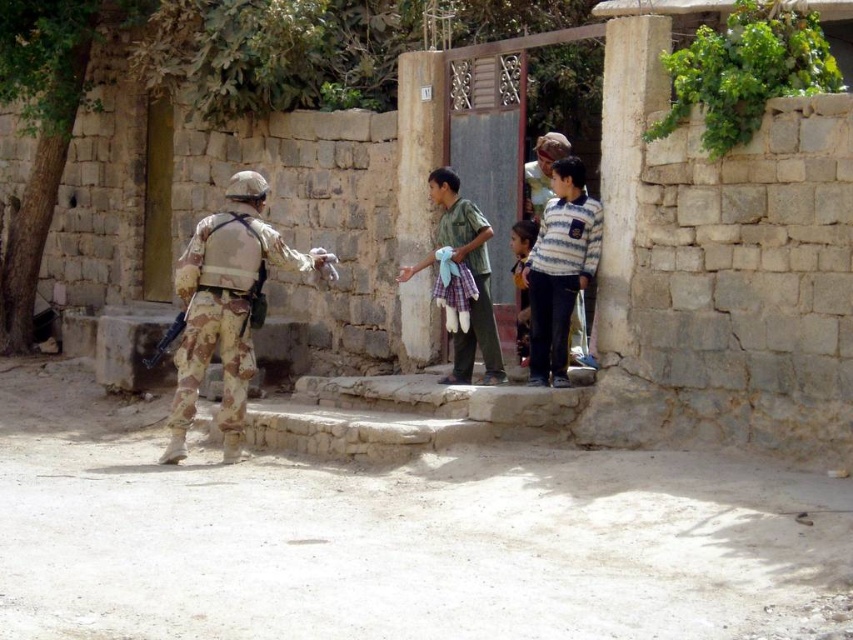
Can you confirm if camouflage uniform at left is taller than striped cotton shirt at center?

Yes.

Which is above, camouflage uniform at left or striped cotton shirt at center?

Positioned higher is striped cotton shirt at center.

Image resolution: width=853 pixels, height=640 pixels. I want to click on camouflage uniform at left, so click(x=225, y=307).

Can you confirm if green plaid shorts at center is wider than light brown fabric shirt at center?

Correct, the width of green plaid shorts at center exceeds that of light brown fabric shirt at center.

Can you confirm if green plaid shorts at center is shorter than light brown fabric shirt at center?

No, green plaid shorts at center is not shorter than light brown fabric shirt at center.

Between point (477, 253) and point (521, 243), which one is positioned behind?

The point (521, 243) is behind.

I want to click on green plaid shorts at center, so click(x=471, y=275).

Describe the element at coordinates (560, 276) in the screenshot. I see `striped cotton shirt at center` at that location.

Between striped cotton shirt at center and green plaid shorts at center, which one is positioned higher?

green plaid shorts at center

Between point (543, 240) and point (430, 257), which one is positioned behind?

The point (430, 257) is behind.

Find the location of a particular element. This screenshot has height=640, width=853. striped cotton shirt at center is located at coordinates (560, 276).